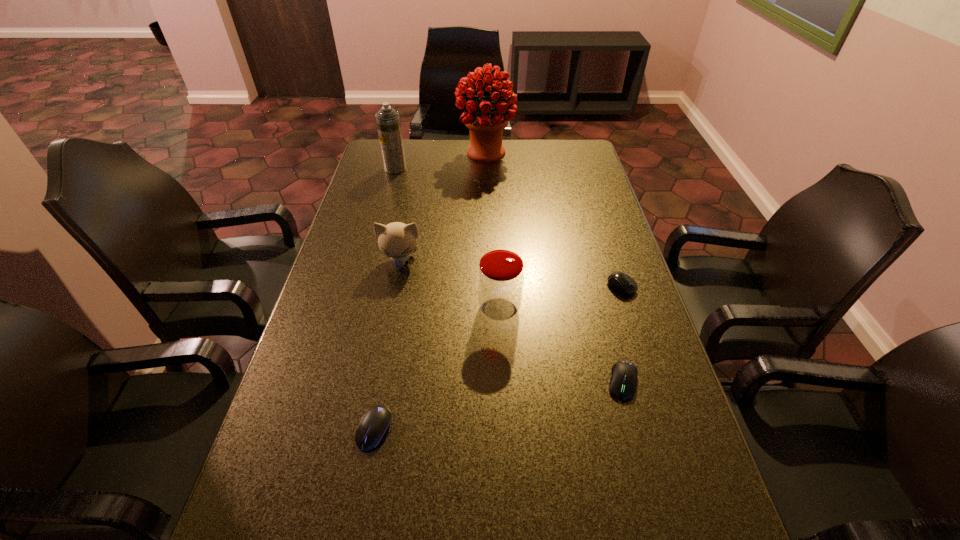
Locate an element on the screen. object present at the far left corner is located at coordinates (388, 121).

Identify the location of vacant area at the far edge. (431, 166).

This screenshot has width=960, height=540. I want to click on vacant space at the left edge of the desktop, so click(x=366, y=218).

Where is `free space at the right edge of the desktop`? free space at the right edge of the desktop is located at coordinates (572, 257).

This screenshot has height=540, width=960. In order to click on free space at the far left corner of the desktop in this screenshot , I will do `click(407, 152)`.

Find the location of `vacant region at the far right corner of the desktop`. vacant region at the far right corner of the desktop is located at coordinates (571, 163).

This screenshot has width=960, height=540. I want to click on vacant point located between the tallest object and the farthest computer mouse, so click(554, 220).

The height and width of the screenshot is (540, 960). Identify the location of free point between the sixth farthest object and the bouquet. (554, 267).

The height and width of the screenshot is (540, 960). In order to click on unoccupied area between the third tallest object and the tallest object in this screenshot , I will do `click(492, 231)`.

The height and width of the screenshot is (540, 960). Find the location of `vacant space that is in between the fourth shortest object and the jar`. vacant space that is in between the fourth shortest object and the jar is located at coordinates (450, 285).